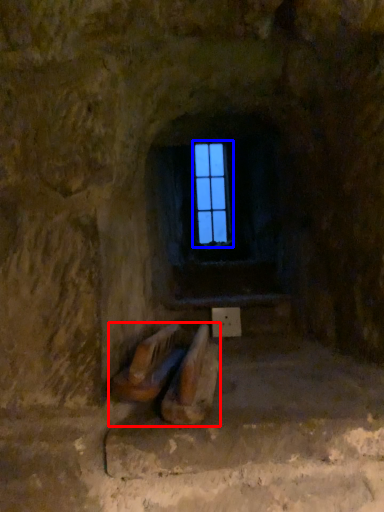
Question: Among these objects, which one is farthest to the camera, furniture (highlighted by a red box) or window frame (highlighted by a blue box)?

Choices:
 (A) furniture
 (B) window frame

Answer: (B)